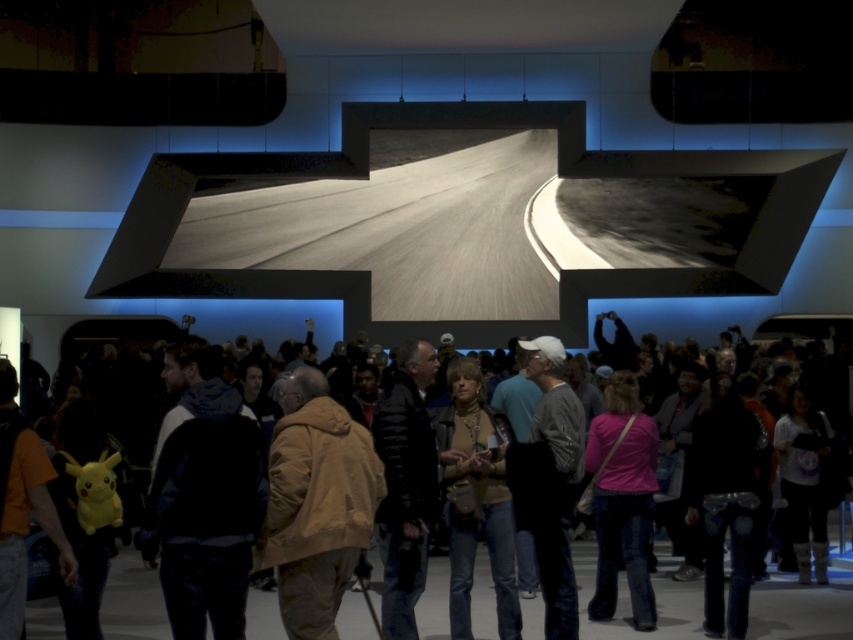
Between dark blue hoodie at center and brown leather jacket at center, which one appears on the left side from the viewer's perspective?

dark blue hoodie at center

Is point (202, 515) less distant than point (492, 621)?

Yes, it is.

Locate an element on the screen. Image resolution: width=853 pixels, height=640 pixels. dark blue hoodie at center is located at coordinates (202, 497).

Can you confirm if brown leather jacket at center is positioned to the left of black leather jacket at center?

Incorrect, brown leather jacket at center is not on the left side of black leather jacket at center.

Is point (759, 598) closer to camera compared to point (434, 472)?

That is False.

Image resolution: width=853 pixels, height=640 pixels. Identify the location of brown leather jacket at center. (801, 609).

Can you confirm if tan suede jacket at center is positioned above pink fabric shirt at center?

Indeed, tan suede jacket at center is positioned over pink fabric shirt at center.

Is tan suede jacket at center to the left of pink fabric shirt at center from the viewer's perspective?

Indeed, tan suede jacket at center is positioned on the left side of pink fabric shirt at center.

Image resolution: width=853 pixels, height=640 pixels. Identify the location of tan suede jacket at center. (316, 502).

What are the coordinates of `tan suede jacket at center` in the screenshot? It's located at (316, 502).